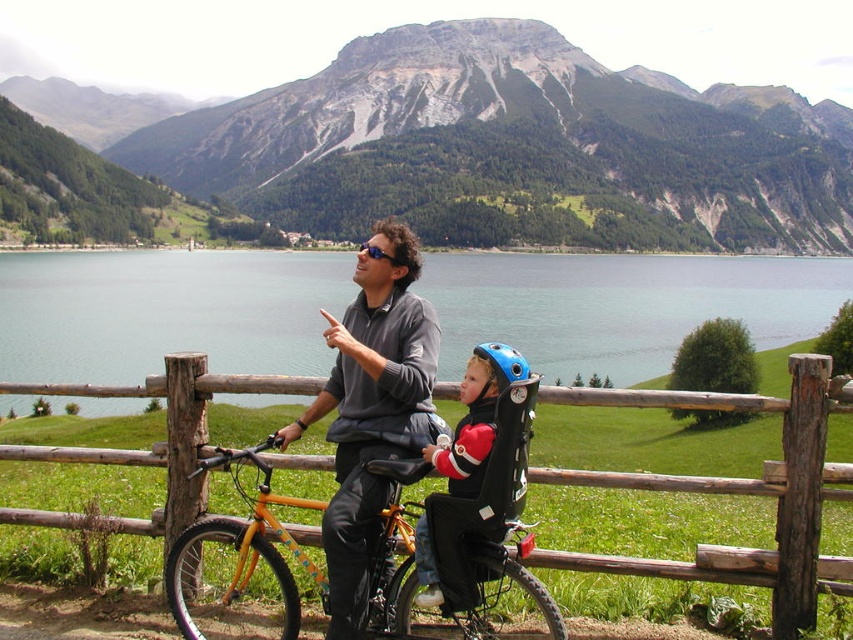
Can you confirm if matte black helmet at center is thinner than blue matte helmet at center?

Indeed, matte black helmet at center has a lesser width compared to blue matte helmet at center.

Who is lower down, matte black helmet at center or blue matte helmet at center?

matte black helmet at center is lower down.

Which is behind, point (492, 435) or point (514, 355)?

Positioned behind is point (514, 355).

You are a GUI agent. You are given a task and a screenshot of the screen. Output one action in this format:
    pyautogui.click(x=<x>, y=<y>)
    Task: Click on the matte black helmet at center
    
    Given the screenshot: What is the action you would take?
    pyautogui.click(x=476, y=417)

Can you confirm if blue water at upper center is thinner than blue matte helmet at center?

No, blue water at upper center is not thinner than blue matte helmet at center.

Which is in front, point (601, 348) or point (489, 353)?

Point (489, 353) is in front.

At what (x,y) coordinates should I click in order to perform the action: click on blue water at upper center. Please return your answer as a coordinate pair (x, y). Looking at the image, I should click on (166, 312).

Between point (291, 316) and point (627, 477), which one is positioned behind?

The point (291, 316) is behind.

Between point (51, 365) and point (187, 481), which one is positioned in front?

Point (187, 481)

Where is `blue water at upper center`? blue water at upper center is located at coordinates (166, 312).